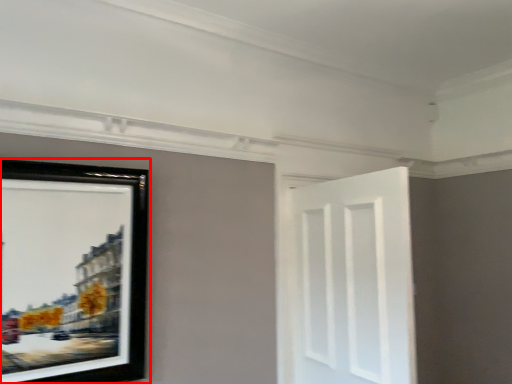
Question: In this image, where is picture frame (annotated by the red box) located relative to door?

Choices:
 (A) right
 (B) left

Answer: (B)